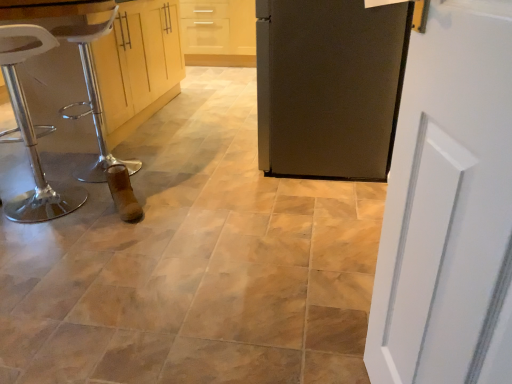
Locate an element on the screen. The width and height of the screenshot is (512, 384). free space between matte black refrigerator at center, marked as the first door in a right-to-left arrangement, and white plastic bar stool at left is located at coordinates (205, 162).